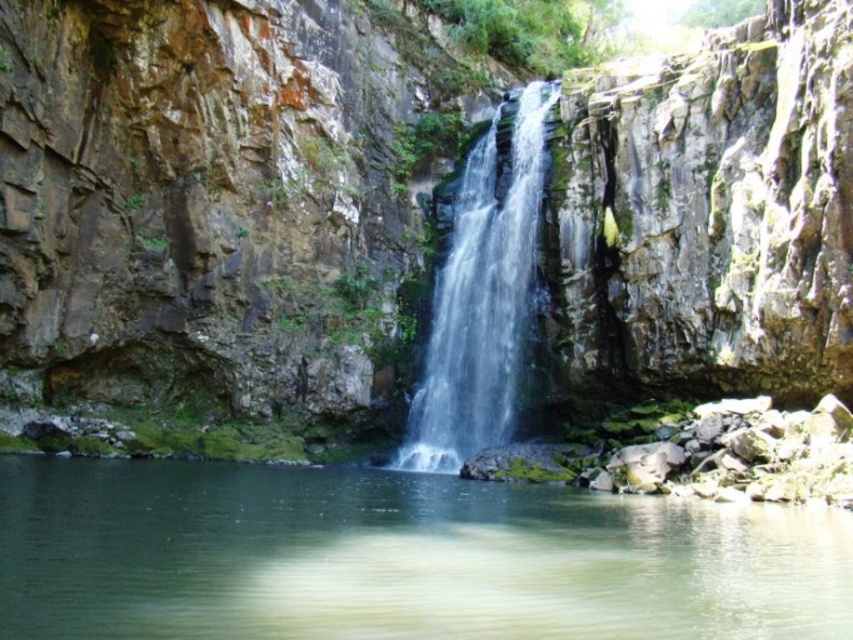
Question: Among these objects, which one is farthest from the camera?

Choices:
 (A) green mossy rock at center
 (B) clear water at center

Answer: (B)

Question: Which object is the closest to the green mossy rock at center?

Choices:
 (A) green translucent water at center
 (B) clear water at center

Answer: (B)

Question: Does green translucent water at center appear over clear water at center?

Choices:
 (A) no
 (B) yes

Answer: (A)

Question: Is green mossy rock at center thinner than green translucent water at center?

Choices:
 (A) yes
 (B) no

Answer: (B)

Question: Which point is closer to the camera?

Choices:
 (A) (432, 168)
 (B) (421, 381)

Answer: (B)

Question: Is green mossy rock at center above green translucent water at center?

Choices:
 (A) no
 (B) yes

Answer: (B)